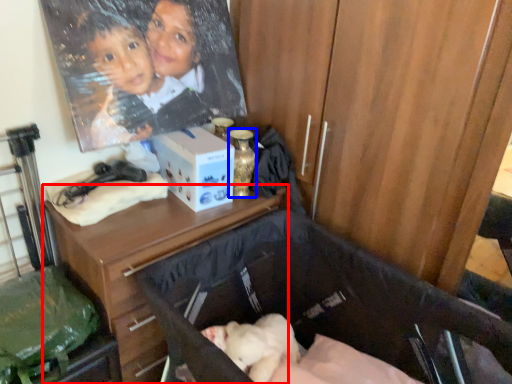
Question: Among these objects, which one is nearest to the camera, desk (highlighted by a red box) or bottle (highlighted by a blue box)?

Choices:
 (A) desk
 (B) bottle

Answer: (A)